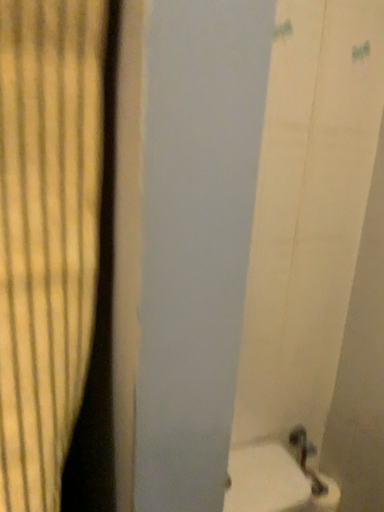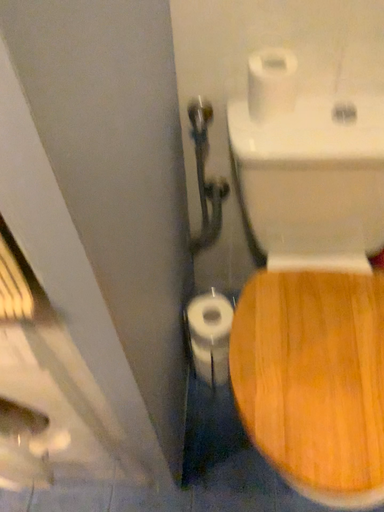
Question: How did the camera likely rotate when shooting the video?

Choices:
 (A) rotated upward
 (B) rotated downward

Answer: (B)